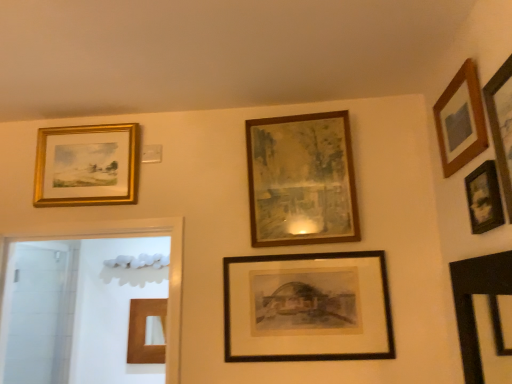
In order to face wooden frame at center, placed as the fifth picture frame when sorted from right to left, should I rotate leftwards or rightwards?

To face it directly, rotate right by 5.836 degrees.

Based on the photo, in order to face wooden picture frame at upper right, which is the 6th picture frame in left-to-right order, should I rotate leftwards or rightwards?

You should rotate right by 24.977 degrees.

Consider the image. How much space does wooden picture frame at upper right, which is the 6th picture frame in left-to-right order, occupy horizontally?

The width of wooden picture frame at upper right, which is the 6th picture frame in left-to-right order, is 1.60 inches.

The image size is (512, 384). In order to click on wooden picture frame at upper right, acting as the fourth picture frame starting from the left in this screenshot , I will do `click(502, 125)`.

What do you see at coordinates (87, 165) in the screenshot? I see `gold/gilded picture frame at upper left, which is counted as the sixth picture frame, starting from the right` at bounding box center [87, 165].

What are the coordinates of `wooden photo frame at upper right, which ranks as the fifth picture frame in left-to-right order` in the screenshot? It's located at (484, 198).

The image size is (512, 384). Identify the location of black matte picture frame at center, which appears as the 3th picture frame when viewed from the left. (307, 307).

Which is more to the left, wooden photo frame at upper right, the second picture frame when ordered from right to left, or gold/gilded picture frame at upper left, which is counted as the sixth picture frame, starting from the right?

From the viewer's perspective, gold/gilded picture frame at upper left, which is counted as the sixth picture frame, starting from the right, appears more on the left side.

Measure the distance between wooden photo frame at upper right, the second picture frame when ordered from right to left, and gold/gilded picture frame at upper left, the 1th picture frame from the left.

The distance of wooden photo frame at upper right, the second picture frame when ordered from right to left, from gold/gilded picture frame at upper left, the 1th picture frame from the left, is 4.80 feet.

Is point (496, 193) positioned after point (66, 135)?

No, it is not.

What's the angular difference between wooden photo frame at upper right, the second picture frame when ordered from right to left, and gold/gilded picture frame at upper left, which is counted as the sixth picture frame, starting from the right,'s facing directions?

There is a 90-degree angle between the facing directions of wooden photo frame at upper right, the second picture frame when ordered from right to left, and gold/gilded picture frame at upper left, which is counted as the sixth picture frame, starting from the right.

Consider the image. Which is more to the left, wooden frame at center, the second picture frame when ordered from left to right, or wooden picture frame at upper right, acting as the fourth picture frame starting from the left?

From the viewer's perspective, wooden frame at center, the second picture frame when ordered from left to right, appears more on the left side.

Which of these two, wooden frame at center, placed as the fifth picture frame when sorted from right to left, or wooden picture frame at upper right, positioned as the 3th picture frame in right-to-left order, is thinner?

wooden picture frame at upper right, positioned as the 3th picture frame in right-to-left order.

From the image's perspective, would you say wooden frame at center, the second picture frame when ordered from left to right, is shown under black matte picture frame at center, which appears as the fourth picture frame when viewed from the right?

No, from the image's perspective, wooden frame at center, the second picture frame when ordered from left to right, is not below black matte picture frame at center, which appears as the fourth picture frame when viewed from the right.

Is wooden frame at center, placed as the fifth picture frame when sorted from right to left, not near black matte picture frame at center, which appears as the 3th picture frame when viewed from the left?

They are positioned close to each other.

Which object is further away from the camera, wooden frame at center, the second picture frame when ordered from left to right, or black matte picture frame at center, which appears as the 3th picture frame when viewed from the left?

Positioned behind is wooden frame at center, the second picture frame when ordered from left to right.

What are the coordinates of `the 3rd picture frame below the wooden frame at center, placed as the fifth picture frame when sorted from right to left (from a real-world perspective)` in the screenshot? It's located at click(307, 307).

Considering the sizes of gold/gilded picture frame at upper left, the 1th picture frame from the left, and wooden frame at center, the second picture frame when ordered from left to right, in the image, is gold/gilded picture frame at upper left, the 1th picture frame from the left, taller or shorter than wooden frame at center, the second picture frame when ordered from left to right,?

gold/gilded picture frame at upper left, the 1th picture frame from the left, is shorter than wooden frame at center, the second picture frame when ordered from left to right.

Which object is thinner, gold/gilded picture frame at upper left, the 1th picture frame from the left, or wooden frame at center, placed as the fifth picture frame when sorted from right to left?

gold/gilded picture frame at upper left, the 1th picture frame from the left, is thinner.

Identify the location of picture frame behind the wooden frame at center, placed as the fifth picture frame when sorted from right to left. (87, 165).

Is gold/gilded picture frame at upper left, which is counted as the sixth picture frame, starting from the right, facing towards wooden frame at center, placed as the fifth picture frame when sorted from right to left?

No, gold/gilded picture frame at upper left, which is counted as the sixth picture frame, starting from the right, is not aimed at wooden frame at center, placed as the fifth picture frame when sorted from right to left.

Who is bigger, wooden picture frame at upper right, which is the 6th picture frame in left-to-right order, or wooden frame at center, the second picture frame when ordered from left to right?

Bigger between the two is wooden frame at center, the second picture frame when ordered from left to right.

From the image's perspective, is wooden picture frame at upper right, which is the 6th picture frame in left-to-right order, above or below wooden frame at center, placed as the fifth picture frame when sorted from right to left?

Clearly, from the image's perspective, wooden picture frame at upper right, which is the 6th picture frame in left-to-right order, is above wooden frame at center, placed as the fifth picture frame when sorted from right to left.

Looking at this image, how different are the orientations of wooden picture frame at upper right, placed as the first picture frame when sorted from right to left, and wooden frame at center, the second picture frame when ordered from left to right, in degrees?

90.1 degrees.

Can you tell me how much black matte picture frame at center, which appears as the fourth picture frame when viewed from the right, and gold/gilded picture frame at upper left, which is counted as the sixth picture frame, starting from the right, differ in facing direction?

0.0853 degrees separate the facing orientations of black matte picture frame at center, which appears as the fourth picture frame when viewed from the right, and gold/gilded picture frame at upper left, which is counted as the sixth picture frame, starting from the right.

How distant is black matte picture frame at center, which appears as the 3th picture frame when viewed from the left, from gold/gilded picture frame at upper left, which is counted as the sixth picture frame, starting from the right?

They are 80.77 centimeters apart.

From a real-world perspective, between black matte picture frame at center, which appears as the fourth picture frame when viewed from the right, and gold/gilded picture frame at upper left, which is counted as the sixth picture frame, starting from the right, who is vertically lower?

black matte picture frame at center, which appears as the fourth picture frame when viewed from the right, is physically lower.

Is black matte picture frame at center, which appears as the 3th picture frame when viewed from the left, outside of gold/gilded picture frame at upper left, the 1th picture frame from the left?

Yes, black matte picture frame at center, which appears as the 3th picture frame when viewed from the left, is not within gold/gilded picture frame at upper left, the 1th picture frame from the left.

Which object is positioned more to the right, black matte picture frame at center, which appears as the fourth picture frame when viewed from the right, or wooden frame at center, the second picture frame when ordered from left to right?

black matte picture frame at center, which appears as the fourth picture frame when viewed from the right, is more to the right.

Consider the image. Is wooden frame at center, placed as the fifth picture frame when sorted from right to left, at the back of black matte picture frame at center, which appears as the 3th picture frame when viewed from the left?

black matte picture frame at center, which appears as the 3th picture frame when viewed from the left, does not have its back to wooden frame at center, placed as the fifth picture frame when sorted from right to left.

From a real-world perspective, is black matte picture frame at center, which appears as the 3th picture frame when viewed from the left, located beneath wooden frame at center, placed as the fifth picture frame when sorted from right to left?

Indeed, from a real-world perspective, black matte picture frame at center, which appears as the 3th picture frame when viewed from the left, is positioned beneath wooden frame at center, placed as the fifth picture frame when sorted from right to left.

The image size is (512, 384). Identify the location of the 2nd picture frame positioned below the wooden frame at center, the second picture frame when ordered from left to right (from the image's perspective). (307, 307).

From the wooden photo frame at upper right, the second picture frame when ordered from right to left, count the 4th picture frame to the left and point to it. Please provide its 2D coordinates.

[(87, 165)]

This screenshot has height=384, width=512. Find the location of `picture frame that is the 4th object located in front of the wooden frame at center, the second picture frame when ordered from left to right`. picture frame that is the 4th object located in front of the wooden frame at center, the second picture frame when ordered from left to right is located at coordinates (502, 125).

Based on their spatial positions, is wooden photo frame at upper right, the second picture frame when ordered from right to left, or wooden picture frame at upper right, which is the 6th picture frame in left-to-right order, further from gold/gilded picture frame at upper left, the 1th picture frame from the left?

wooden photo frame at upper right, the second picture frame when ordered from right to left, lies further to gold/gilded picture frame at upper left, the 1th picture frame from the left, than the other object.

Based on their spatial positions, is black matte picture frame at center, which appears as the 3th picture frame when viewed from the left, or wooden frame at center, placed as the fifth picture frame when sorted from right to left, further from wooden photo frame at upper right, the second picture frame when ordered from right to left?

Based on the image, black matte picture frame at center, which appears as the 3th picture frame when viewed from the left, appears to be further to wooden photo frame at upper right, the second picture frame when ordered from right to left.

From the image, which object appears to be farther from wooden picture frame at upper right, positioned as the 3th picture frame in right-to-left order, gold/gilded picture frame at upper left, which is counted as the sixth picture frame, starting from the right, or wooden frame at center, the second picture frame when ordered from left to right?

gold/gilded picture frame at upper left, which is counted as the sixth picture frame, starting from the right, is positioned further to the anchor wooden picture frame at upper right, positioned as the 3th picture frame in right-to-left order.

Looking at the image, which one is located further to wooden photo frame at upper right, the second picture frame when ordered from right to left, black matte picture frame at center, which appears as the 3th picture frame when viewed from the left, or gold/gilded picture frame at upper left, the 1th picture frame from the left?

The object further to wooden photo frame at upper right, the second picture frame when ordered from right to left, is gold/gilded picture frame at upper left, the 1th picture frame from the left.

Which object lies nearer to the anchor point wooden photo frame at upper right, which ranks as the fifth picture frame in left-to-right order, wooden picture frame at upper right, placed as the first picture frame when sorted from right to left, or black matte picture frame at center, which appears as the fourth picture frame when viewed from the right?

wooden picture frame at upper right, placed as the first picture frame when sorted from right to left, is positioned closer to the anchor wooden photo frame at upper right, which ranks as the fifth picture frame in left-to-right order.

Based on their spatial positions, is wooden frame at center, the second picture frame when ordered from left to right, or wooden picture frame at upper right, which is the 6th picture frame in left-to-right order, closer to gold/gilded picture frame at upper left, the 1th picture frame from the left?

wooden frame at center, the second picture frame when ordered from left to right, is positioned closer to the anchor gold/gilded picture frame at upper left, the 1th picture frame from the left.

Estimate the real-world distances between objects in this image. Which object is closer to wooden picture frame at upper right, positioned as the 3th picture frame in right-to-left order, wooden picture frame at upper right, which is the 6th picture frame in left-to-right order, or black matte picture frame at center, which appears as the 3th picture frame when viewed from the left?

Based on the image, wooden picture frame at upper right, which is the 6th picture frame in left-to-right order, appears to be nearer to wooden picture frame at upper right, positioned as the 3th picture frame in right-to-left order.

Based on their spatial positions, is wooden photo frame at upper right, the second picture frame when ordered from right to left, or wooden frame at center, the second picture frame when ordered from left to right, further from gold/gilded picture frame at upper left, the 1th picture frame from the left?

wooden photo frame at upper right, the second picture frame when ordered from right to left, is further to gold/gilded picture frame at upper left, the 1th picture frame from the left.

Identify the location of picture frame located between gold/gilded picture frame at upper left, which is counted as the sixth picture frame, starting from the right, and black matte picture frame at center, which appears as the 3th picture frame when viewed from the left, in the left-right direction. (302, 180).

In order to click on picture frame between wooden picture frame at upper right, positioned as the 3th picture frame in right-to-left order, and wooden picture frame at upper right, which is the 6th picture frame in left-to-right order, in the front-back direction in this screenshot , I will do `click(484, 198)`.